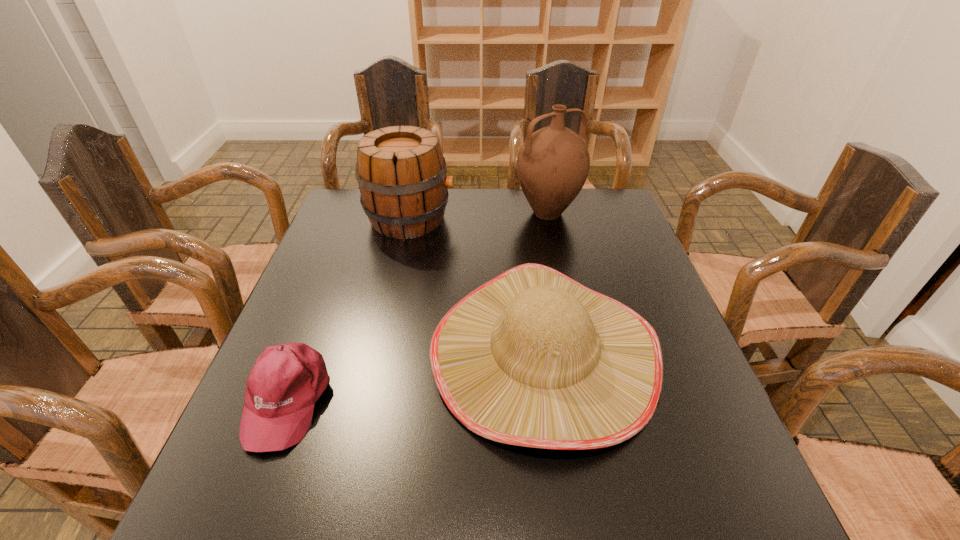
Locate an element on the screen. The image size is (960, 540). cider situated at the left edge is located at coordinates (401, 171).

I want to click on baseball cap present at the left edge, so click(x=287, y=380).

Identify the location of pitcher that is at the right edge. This screenshot has height=540, width=960. (553, 163).

You are a GUI agent. You are given a task and a screenshot of the screen. Output one action in this format:
    pyautogui.click(x=<x>, y=<y>)
    Task: Click on the sunhat positioned at the right edge
    The image size is (960, 540).
    Given the screenshot: What is the action you would take?
    pyautogui.click(x=533, y=358)

At what (x,y) coordinates should I click in order to perform the action: click on object located in the far left corner section of the desktop. Please return your answer as a coordinate pair (x, y). This screenshot has width=960, height=540. Looking at the image, I should click on (401, 171).

Where is `object that is at the far right corner`? object that is at the far right corner is located at coordinates (553, 163).

Locate an element on the screen. vacant space at the far edge of the desktop is located at coordinates (501, 195).

At what (x,y) coordinates should I click in order to perform the action: click on vacant space at the near edge of the desktop. Please return your answer as a coordinate pair (x, y). Looking at the image, I should click on (527, 485).

What are the coordinates of `vacant space at the left edge of the desktop` in the screenshot? It's located at (345, 251).

In the image, there is a desktop. Where is `vacant region at the right edge`? vacant region at the right edge is located at coordinates (593, 271).